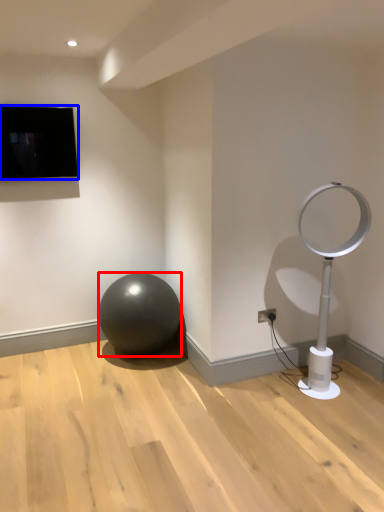
Question: Which of the following is the closest to the observer, ball (highlighted by a red box) or television (highlighted by a blue box)?

Choices:
 (A) ball
 (B) television

Answer: (A)